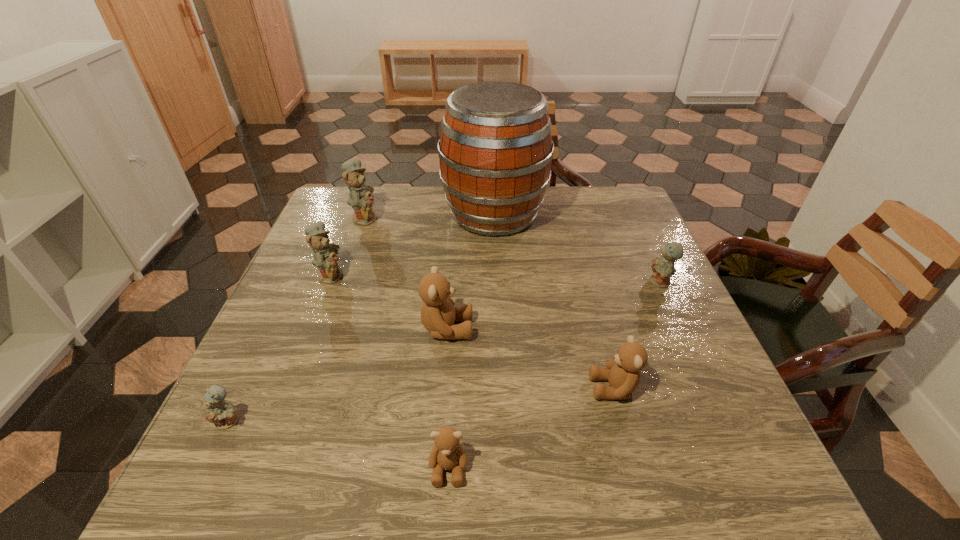
Locate an element on the screen. The image size is (960, 540). free space located 0.380m on the front-facing side of the rightmost object is located at coordinates (494, 282).

Locate an element on the screen. free space located 0.180m on the front-facing side of the second object from right to left is located at coordinates (497, 388).

Identify the location of vacant space located on the front-facing side of the second object from right to left. (409, 388).

Locate an element on the screen. The height and width of the screenshot is (540, 960). free space located on the front-facing side of the second object from right to left is located at coordinates (471, 388).

Identify the location of cider situated at the far edge. This screenshot has width=960, height=540. (495, 150).

The image size is (960, 540). In order to click on teddy bear present at the far edge in this screenshot , I will do [x=360, y=198].

I want to click on object present at the near edge, so click(447, 453).

The width and height of the screenshot is (960, 540). Find the location of `object located in the right edge section of the desktop`. object located in the right edge section of the desktop is located at coordinates [663, 267].

You are a GUI agent. You are given a task and a screenshot of the screen. Output one action in this format:
    pyautogui.click(x=<x>, y=<y>)
    Task: Click on the object situated at the far left corner
    The height and width of the screenshot is (540, 960).
    Given the screenshot: What is the action you would take?
    [x=360, y=198]

Image resolution: width=960 pixels, height=540 pixels. I want to click on vacant area at the far edge of the desktop, so click(x=554, y=193).